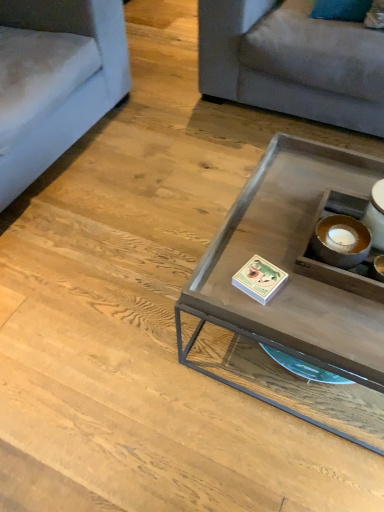
Identify the location of vacant area located to the right-hand side of light blue fabric couch at left, which is the second studio couch in right-to-left order. This screenshot has height=512, width=384. (161, 148).